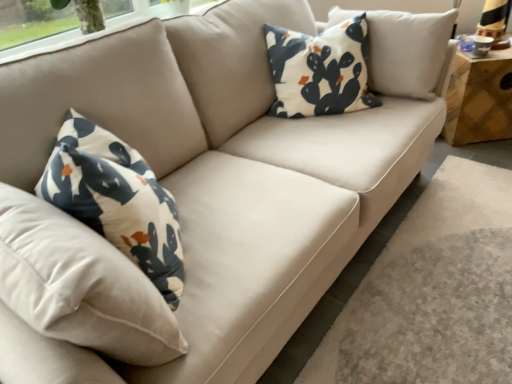
Question: From the image's perspective, is wooden side table at right above white fabric pillow with cactus print at upper center?

Choices:
 (A) no
 (B) yes

Answer: (B)

Question: Considering the relative positions of wooden side table at right and white fabric pillow with cactus print at upper center in the image provided, is wooden side table at right to the left of white fabric pillow with cactus print at upper center from the viewer's perspective?

Choices:
 (A) yes
 (B) no

Answer: (B)

Question: Is wooden side table at right shorter than white fabric pillow with cactus print at upper center?

Choices:
 (A) yes
 (B) no

Answer: (A)

Question: Is the depth of wooden side table at right greater than that of white fabric pillow with cactus print at upper center?

Choices:
 (A) yes
 (B) no

Answer: (A)

Question: Does wooden side table at right turn towards white fabric pillow with cactus print at upper center?

Choices:
 (A) yes
 (B) no

Answer: (B)

Question: Can you confirm if wooden side table at right is thinner than white fabric pillow with cactus print at upper center?

Choices:
 (A) no
 (B) yes

Answer: (A)

Question: Is white fabric pillow with cactus print at upper center closer to camera compared to wooden side table at right?

Choices:
 (A) no
 (B) yes

Answer: (B)

Question: Is white fabric pillow with cactus print at upper center at the right side of wooden side table at right?

Choices:
 (A) yes
 (B) no

Answer: (B)

Question: Can you confirm if white fabric pillow with cactus print at upper center is smaller than wooden side table at right?

Choices:
 (A) no
 (B) yes

Answer: (B)

Question: Is white fabric pillow with cactus print at upper center bigger than wooden side table at right?

Choices:
 (A) yes
 (B) no

Answer: (B)

Question: Is the depth of white fabric pillow with cactus print at upper center greater than that of wooden side table at right?

Choices:
 (A) no
 (B) yes

Answer: (A)

Question: Would you say white fabric pillow with cactus print at upper center contains wooden side table at right?

Choices:
 (A) yes
 (B) no

Answer: (B)

Question: Considering the positions of white fabric pillow with cactus print at upper center and wooden side table at right in the image, is white fabric pillow with cactus print at upper center wider or thinner than wooden side table at right?

Choices:
 (A) wide
 (B) thin

Answer: (B)